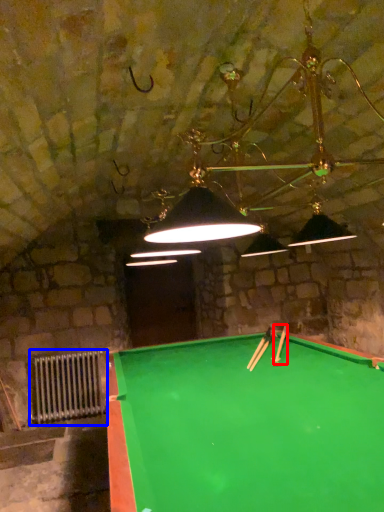
Question: Which object is closer to the camera taking this photo, cue (highlighted by a red box) or radiator (highlighted by a blue box)?

Choices:
 (A) cue
 (B) radiator

Answer: (A)